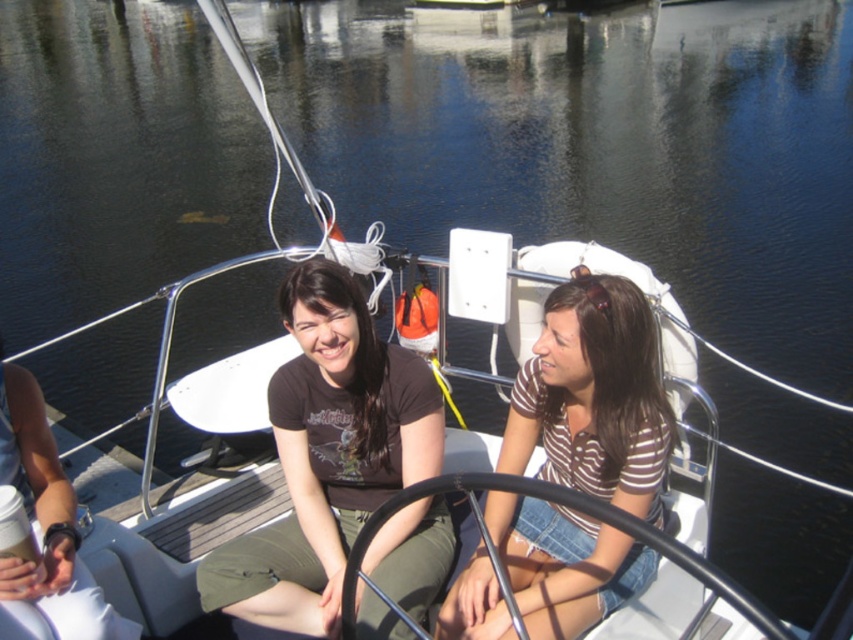
You are a GUI agent. You are given a task and a screenshot of the screen. Output one action in this format:
    pyautogui.click(x=<x>, y=<y>)
    Task: Click on the matte black shirt at center
    
    Given the screenshot: What is the action you would take?
    pyautogui.click(x=318, y=456)

Is matte black shirt at center to the right of brown striped shirt at center from the viewer's perspective?

No, matte black shirt at center is not to the right of brown striped shirt at center.

Where is `matte black shirt at center`? The height and width of the screenshot is (640, 853). matte black shirt at center is located at coordinates (318, 456).

Which is above, matte black shirt at center or white matte cup at lower left?

matte black shirt at center is above.

Does matte black shirt at center appear on the right side of white matte cup at lower left?

Correct, you'll find matte black shirt at center to the right of white matte cup at lower left.

Find the location of a particular element. The height and width of the screenshot is (640, 853). matte black shirt at center is located at coordinates [318, 456].

Where is `matte black shirt at center`? This screenshot has height=640, width=853. matte black shirt at center is located at coordinates (318, 456).

Does brown striped shirt at center have a lesser width compared to white matte cup at lower left?

In fact, brown striped shirt at center might be wider than white matte cup at lower left.

Which is more to the left, brown striped shirt at center or white matte cup at lower left?

Positioned to the left is white matte cup at lower left.

Where is `brown striped shirt at center`? This screenshot has height=640, width=853. brown striped shirt at center is located at coordinates (595, 397).

Where is `brown striped shirt at center`? brown striped shirt at center is located at coordinates (595, 397).